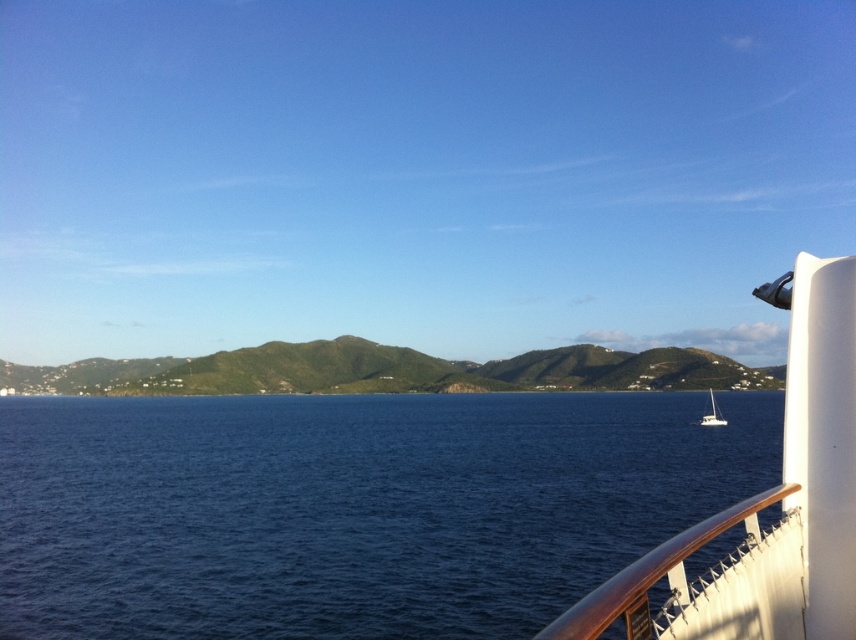
Question: Which object is positioned farthest from the deep blue water at center?

Choices:
 (A) white glossy sailboat at right
 (B) white glossy sailboat at lower right

Answer: (A)

Question: Which object is positioned farthest from the deep blue water at center?

Choices:
 (A) wooden rail at right
 (B) white glossy sailboat at lower right

Answer: (A)

Question: Does deep blue water at center have a greater width compared to wooden rail at right?

Choices:
 (A) yes
 (B) no

Answer: (A)

Question: From the image, what is the correct spatial relationship of deep blue water at center in relation to white glossy sailboat at right?

Choices:
 (A) above
 (B) below

Answer: (B)

Question: Does white glossy sailboat at right have a larger size compared to white glossy sailboat at lower right?

Choices:
 (A) no
 (B) yes

Answer: (A)

Question: Which point is closer to the camera taking this photo?

Choices:
 (A) [714, 420]
 (B) [837, 426]
 (C) [587, 609]
 (D) [10, 573]

Answer: (C)